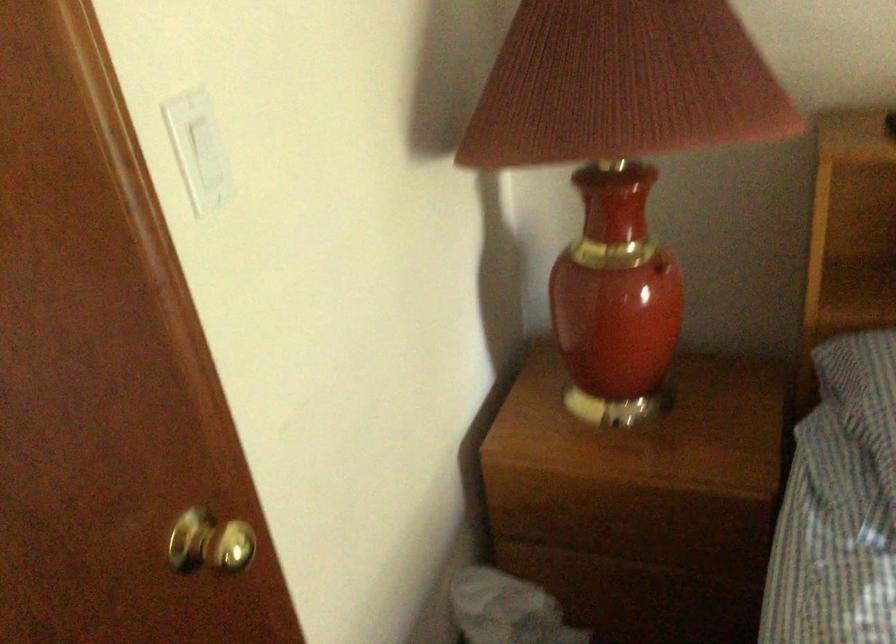
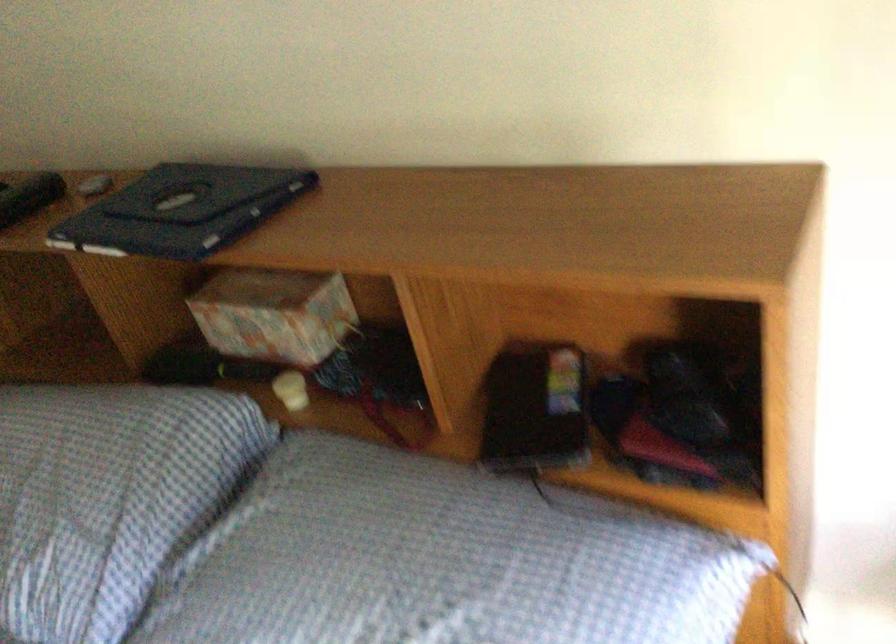
Question: What movement of the cameraman would produce the second image?

Choices:
 (A) Left
 (B) Right
 (C) Forward
 (D) Backward

Answer: (B)